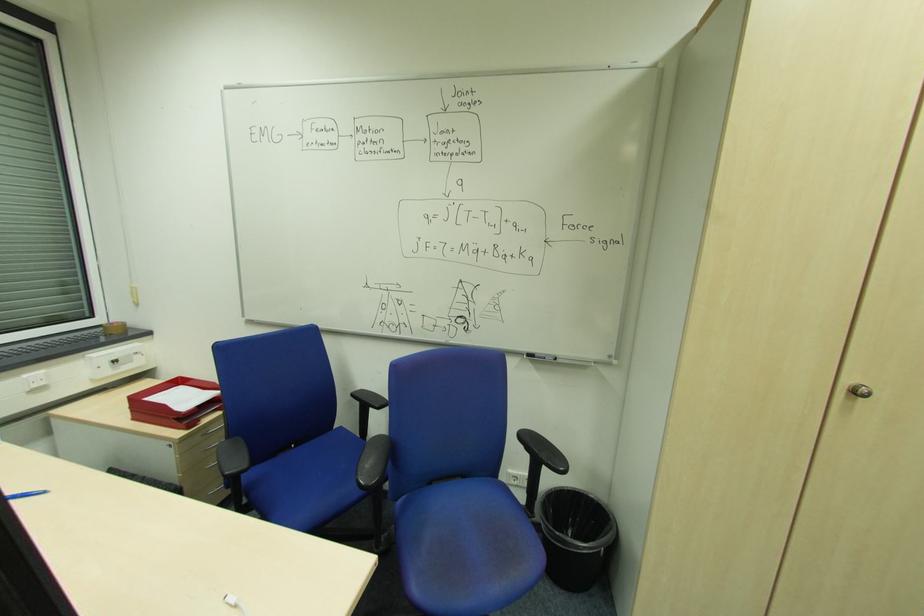
I want to click on metal cabinet knob, so click(x=859, y=390).